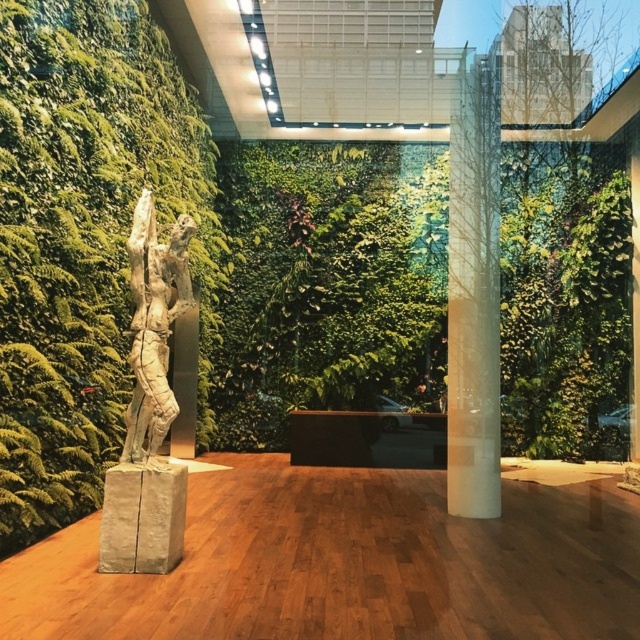
Question: Among these points, which one is farthest from the camera?

Choices:
 (A) (492, 266)
 (B) (182, 252)
 (C) (99, 116)

Answer: (A)

Question: Observing the image, what is the correct spatial positioning of green leafy wall at left in reference to translucent glass column at center?

Choices:
 (A) right
 (B) left

Answer: (B)

Question: Which of these objects is positioned farthest from the bronze statue at center?

Choices:
 (A) green leafy wall at left
 (B) translucent glass column at center

Answer: (B)

Question: Where is green leafy wall at left located in relation to translucent glass column at center in the image?

Choices:
 (A) left
 (B) right

Answer: (A)

Question: Estimate the real-world distances between objects in this image. Which object is farther from the green leafy wall at left?

Choices:
 (A) translucent glass column at center
 (B) bronze statue at center

Answer: (A)

Question: Considering the relative positions of green leafy wall at left and translucent glass column at center in the image provided, where is green leafy wall at left located with respect to translucent glass column at center?

Choices:
 (A) above
 (B) below

Answer: (A)